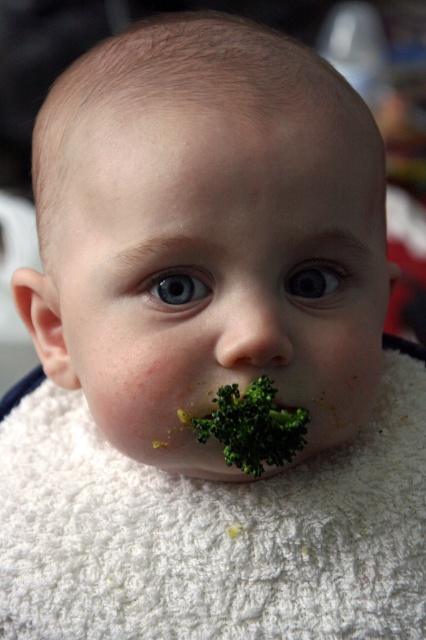
Question: Can you confirm if green matte broccoli at center is positioned to the left of green textured broccoli at mouth?

Choices:
 (A) no
 (B) yes

Answer: (B)

Question: Observing the image, what is the correct spatial positioning of white fluffy blanket at center in reference to blue glossy eye at center?

Choices:
 (A) right
 (B) left

Answer: (B)

Question: Estimate the real-world distances between objects in this image. Which object is closer to the green matte broccoli at center?

Choices:
 (A) green textured broccoli at mouth
 (B) green leafy vegetable at lower center
 (C) blue glossy eye at center

Answer: (C)

Question: Based on their relative distances, which object is nearer to the white fluffy blanket at center?

Choices:
 (A) blue glossy eye at upper left
 (B) green matte broccoli at center
 (C) green textured broccoli at mouth

Answer: (B)

Question: Is blue glossy eye at upper left thinner than green leafy vegetable at lower center?

Choices:
 (A) yes
 (B) no

Answer: (B)

Question: Which of these objects is positioned closest to the white fluffy blanket at center?

Choices:
 (A) blue glossy eye at center
 (B) green leafy vegetable at lower center
 (C) green matte broccoli at center

Answer: (C)